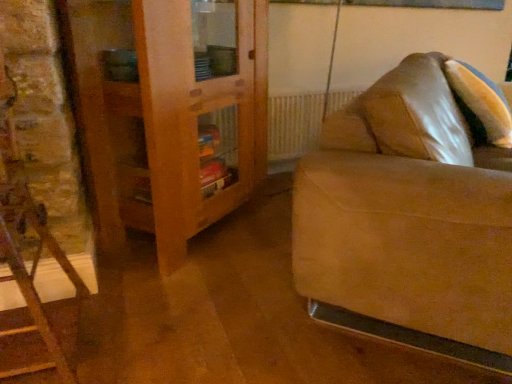
Question: In the image, is wooden cabinet at left on the left side or the right side of suede couch at right?

Choices:
 (A) left
 (B) right

Answer: (A)

Question: From a real-world perspective, relative to suede couch at right, is wooden cabinet at left vertically above or below?

Choices:
 (A) above
 (B) below

Answer: (A)

Question: Considering their positions, is wooden cabinet at left located in front of or behind suede couch at right?

Choices:
 (A) behind
 (B) front

Answer: (A)

Question: Looking at their shapes, would you say suede couch at right is wider or thinner than wooden cabinet at left?

Choices:
 (A) wide
 (B) thin

Answer: (A)

Question: From the image's perspective, is suede couch at right located above or below wooden cabinet at left?

Choices:
 (A) above
 (B) below

Answer: (B)

Question: Relative to wooden cabinet at left, is suede couch at right in front or behind?

Choices:
 (A) front
 (B) behind

Answer: (A)

Question: From a real-world perspective, is suede couch at right physically located above or below wooden cabinet at left?

Choices:
 (A) below
 (B) above

Answer: (A)